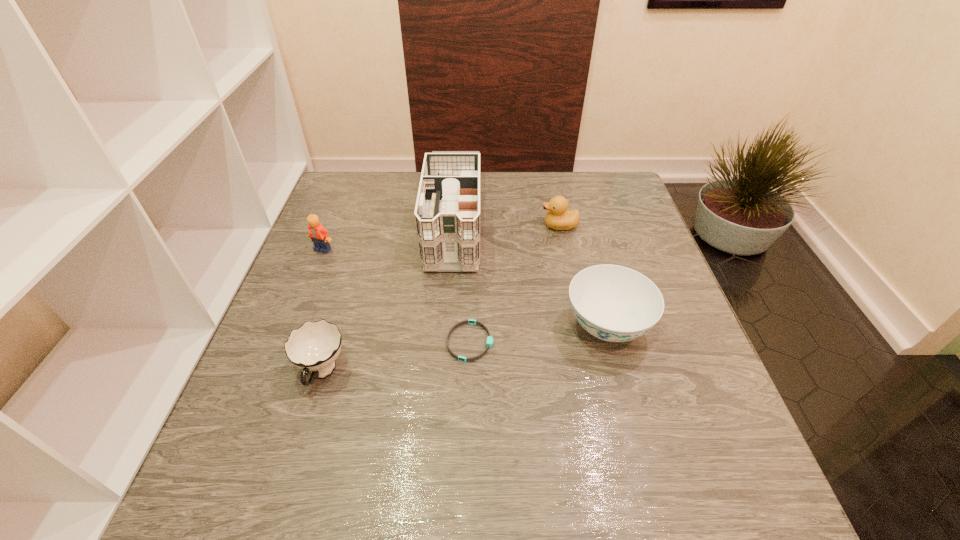
The image size is (960, 540). I want to click on the tallest object, so click(447, 214).

Identify the location of Lego. This screenshot has width=960, height=540. (319, 235).

Where is `chinaware`? Image resolution: width=960 pixels, height=540 pixels. chinaware is located at coordinates (614, 303).

Find the location of a particular element. Image resolution: width=960 pixels, height=540 pixels. duckling is located at coordinates (557, 218).

Image resolution: width=960 pixels, height=540 pixels. Identify the location of the fifth object from right to left. (313, 347).

Locate an element on the screen. the shortest object is located at coordinates (489, 342).

Find the location of a particular element. The height and width of the screenshot is (540, 960). free spot located 0.300m at the entrance of the tallest object is located at coordinates (442, 382).

You are a GUI agent. You are given a task and a screenshot of the screen. Output one action in this format:
    pyautogui.click(x=<x>, y=<y>)
    Task: Click on the vacant space located on the front-facing side of the leftmost object
    The image size is (960, 540).
    Given the screenshot: What is the action you would take?
    pyautogui.click(x=277, y=364)

Find the location of a particular element. The height and width of the screenshot is (540, 960). free space located 0.280m on the left of the chinaware is located at coordinates (435, 326).

You are a GUI agent. You are given a task and a screenshot of the screen. Output one action in this format:
    pyautogui.click(x=<x>, y=<y>)
    Task: Click on the blank area located 0.280m facing forward on the duckling
    
    Given the screenshot: What is the action you would take?
    pyautogui.click(x=439, y=226)